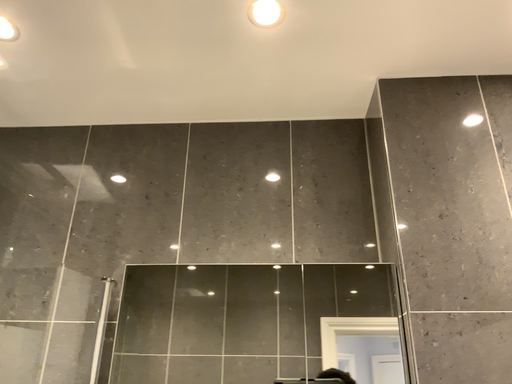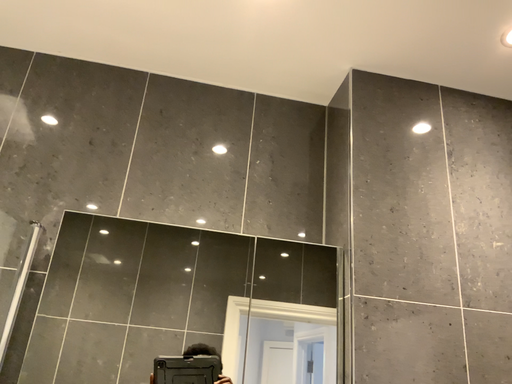
Question: Which way did the camera rotate in the video?

Choices:
 (A) rotated right
 (B) rotated left

Answer: (A)